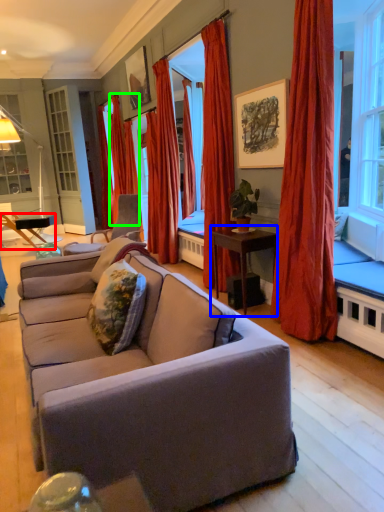
Question: Which object is the closest to the table (highlighted by a red box)? Choose among these: table (highlighted by a blue box) or curtain (highlighted by a green box).

Choices:
 (A) table
 (B) curtain

Answer: (B)